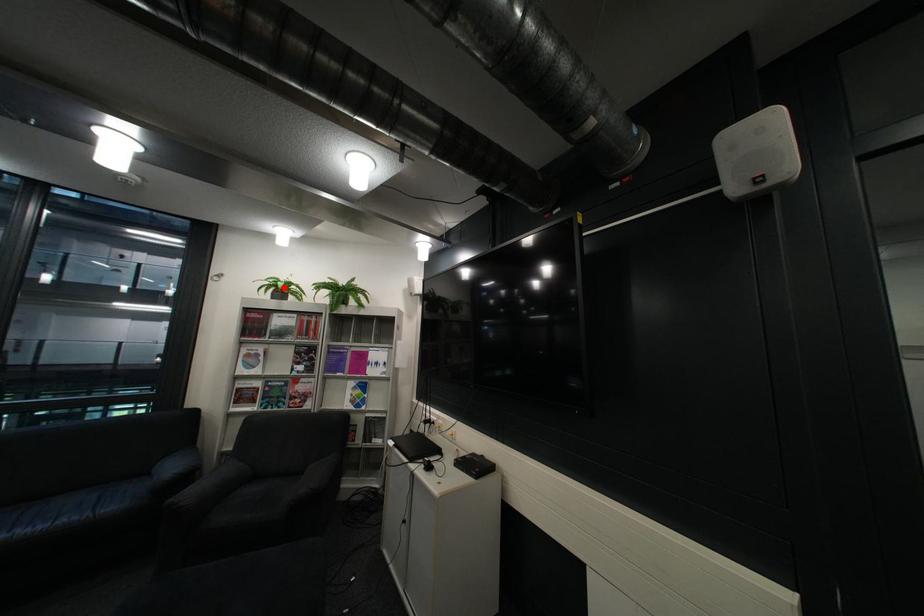
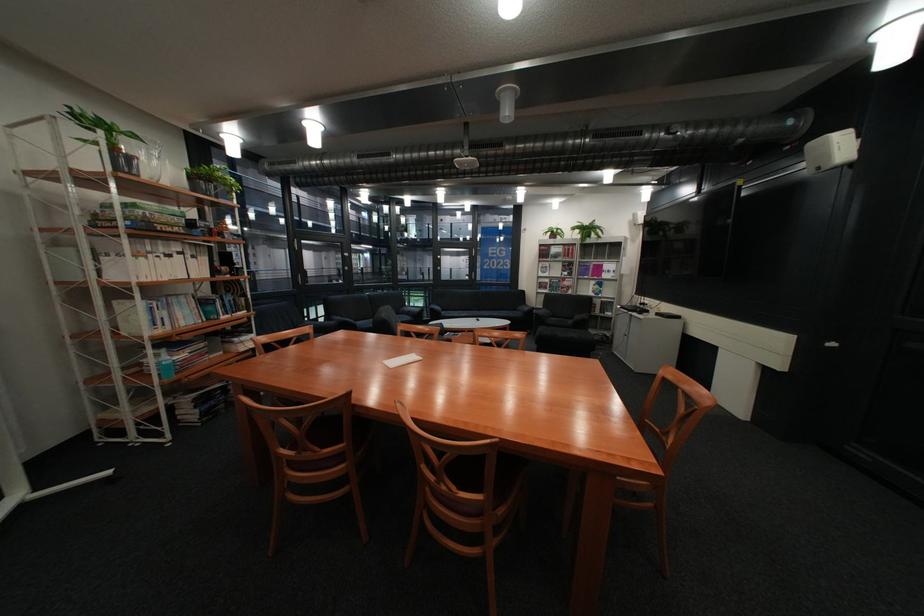
Question: I am providing you with two images of the same scene from different viewpoints. Given a red point in image1, look at the same physical point in image2. Is it:

Choices:
 (A) Closer to the viewpoint
 (B) Farther from the viewpoint

Answer: (A)